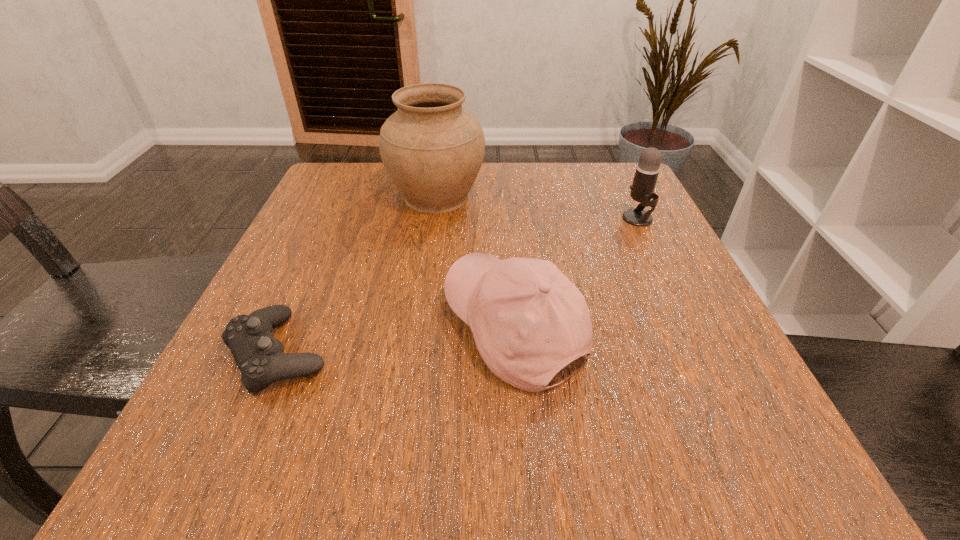
This screenshot has width=960, height=540. What are the coordinates of `vacant point located on the back of the leftmost object` in the screenshot? It's located at (328, 238).

Where is `urn present at the far edge`? Image resolution: width=960 pixels, height=540 pixels. urn present at the far edge is located at coordinates (432, 148).

Locate an element on the screen. This screenshot has height=540, width=960. microphone located at the far edge is located at coordinates (647, 170).

Identify the location of object that is at the left edge. (258, 354).

Identify the location of object that is at the right edge. This screenshot has height=540, width=960. (647, 170).

In order to click on object that is at the far right corner in this screenshot , I will do coord(647,170).

Locate an element on the screen. The height and width of the screenshot is (540, 960). vacant space at the left edge of the desktop is located at coordinates tap(327, 376).

In the image, there is a desktop. Identify the location of vacant region at the right edge. (636, 320).

At what (x,y) coordinates should I click in order to perform the action: click on vacant space at the far left corner. Please return your answer as a coordinate pair (x, y). This screenshot has height=540, width=960. Looking at the image, I should click on (302, 214).

Image resolution: width=960 pixels, height=540 pixels. Find the location of `vacant space at the far right corner of the desktop`. vacant space at the far right corner of the desktop is located at coordinates (576, 170).